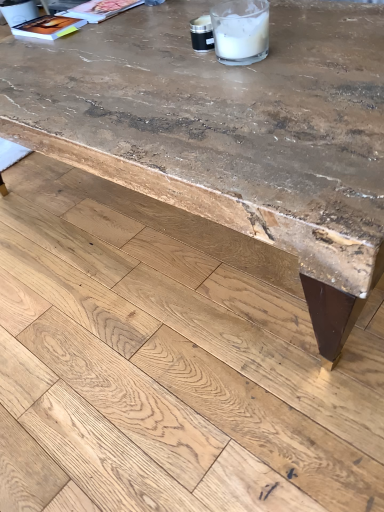
The width and height of the screenshot is (384, 512). Find the location of `vacant area that lies in front of clear plastic straw at upper center`. vacant area that lies in front of clear plastic straw at upper center is located at coordinates (232, 100).